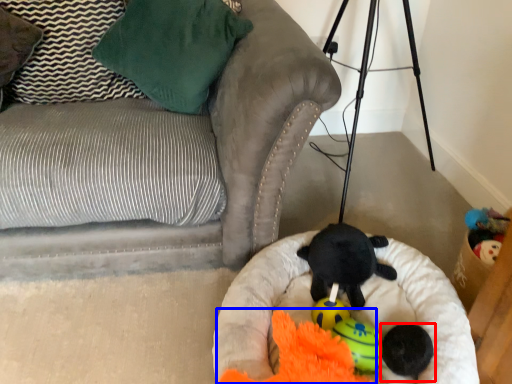
Question: Which point is further to the camera, toy (highlighted by a red box) or toy (highlighted by a blue box)?

Choices:
 (A) toy
 (B) toy

Answer: (A)